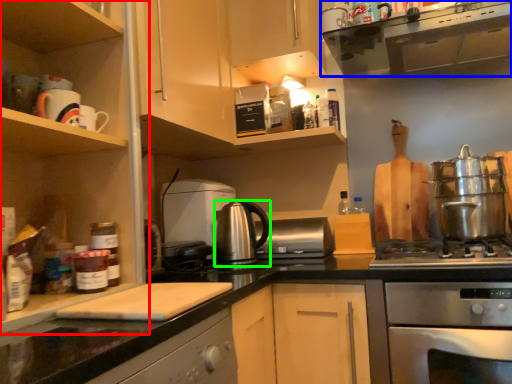
Question: Considering the real-world distances, which object is closest to cabinetry (highlighted by a red box)? home appliance (highlighted by a blue box) or kitchen appliance (highlighted by a green box).

Choices:
 (A) home appliance
 (B) kitchen appliance

Answer: (B)